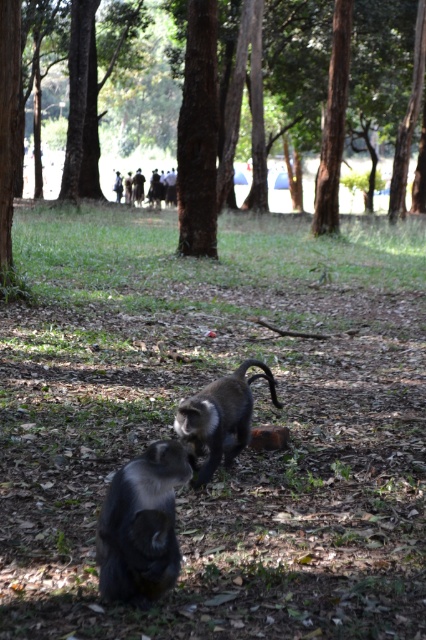
Question: Which object is closer to the camera taking this photo?

Choices:
 (A) shiny black monkey at lower left
 (B) silvery fur monkey at center

Answer: (A)

Question: Is silvery fur monkey at center below shiny black monkey at lower left?

Choices:
 (A) no
 (B) yes

Answer: (A)

Question: In this image, where is brown textured tree at center located relative to shiny black monkey at lower left?

Choices:
 (A) left
 (B) right

Answer: (B)

Question: Which of these objects is positioned farthest from the shiny brown monkey at center?

Choices:
 (A) silvery fur monkey at center
 (B) shiny black monkey at lower left

Answer: (A)

Question: Estimate the real-world distances between objects in this image. Which object is closer to the shiny black monkey at lower left?

Choices:
 (A) silvery fur monkey at center
 (B) shiny brown monkey at center

Answer: (B)

Question: Is silvery fur monkey at center below brown textured tree at center?

Choices:
 (A) no
 (B) yes

Answer: (B)